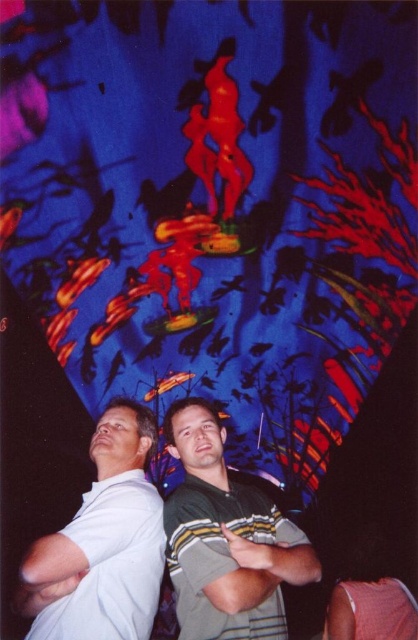
Is green striped shirt at center taller than white cotton shirt at left?

Yes.

Is green striped shirt at center behind white cotton shirt at left?

Yes, it is.

You are a GUI agent. You are given a task and a screenshot of the screen. Output one action in this format:
    pyautogui.click(x=<x>, y=<y>)
    Task: Click on the green striped shirt at center
    The width and height of the screenshot is (418, 640).
    Given the screenshot: What is the action you would take?
    pyautogui.click(x=226, y=540)